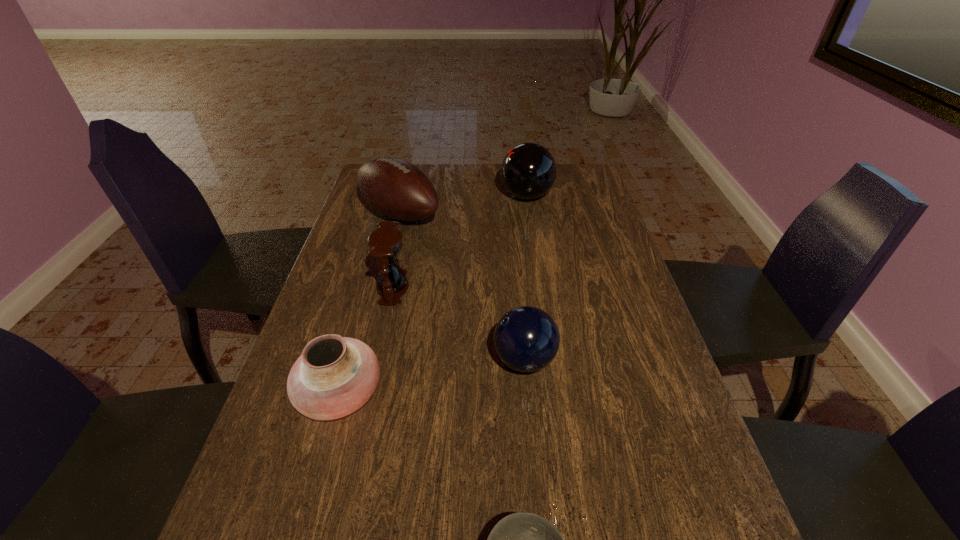
Select which object is the third closest to the football (American). Please provide its 2D coordinates. Your answer should be formatted as a tuple, i.e. [(x, y)], where the tuple contains the x and y coordinates of a point satisfying the conditions above.

[(526, 338)]